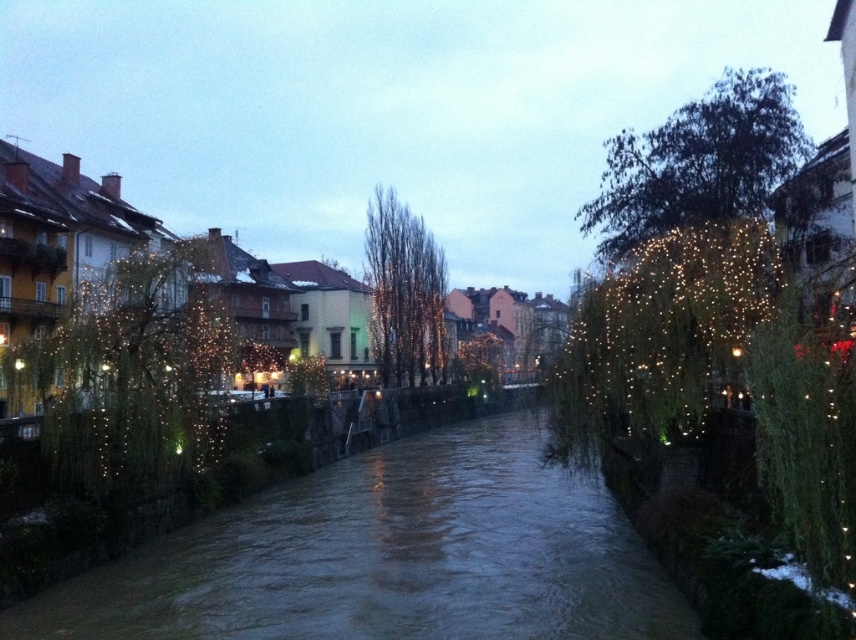
You are standing at the riverside in the image and want to toss a pebble into the brown water at center. Considering the distance between you and the water, will the pebble reach the water if you throw it with an average adult arm strength?

The distance between you and the brown water at center is 64.67 feet. An average adult can throw a pebble about 30 to 40 feet. Therefore, the pebble will not reach the water.

You are a city planner assessing the urban space. You need to determine which object is shorter between the illuminated wire at left and the green leafy tree at upper right. Based on the scene, which one is shorter?

The illuminated wire at left is shorter than the green leafy tree at upper right.